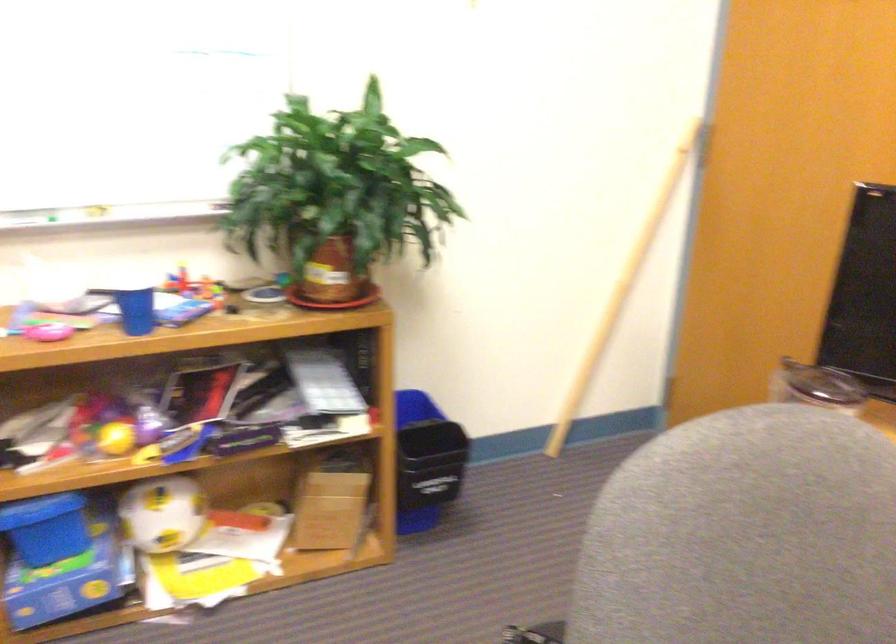
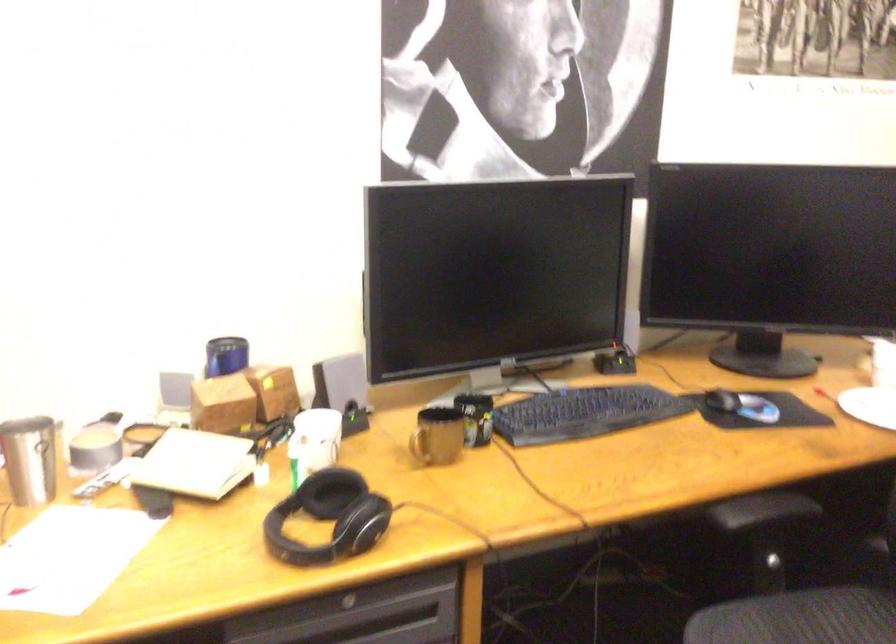
The first image is from the beginning of the video and the second image is from the end. How did the camera likely rotate when shooting the video?

The camera's rotation is toward right-down.